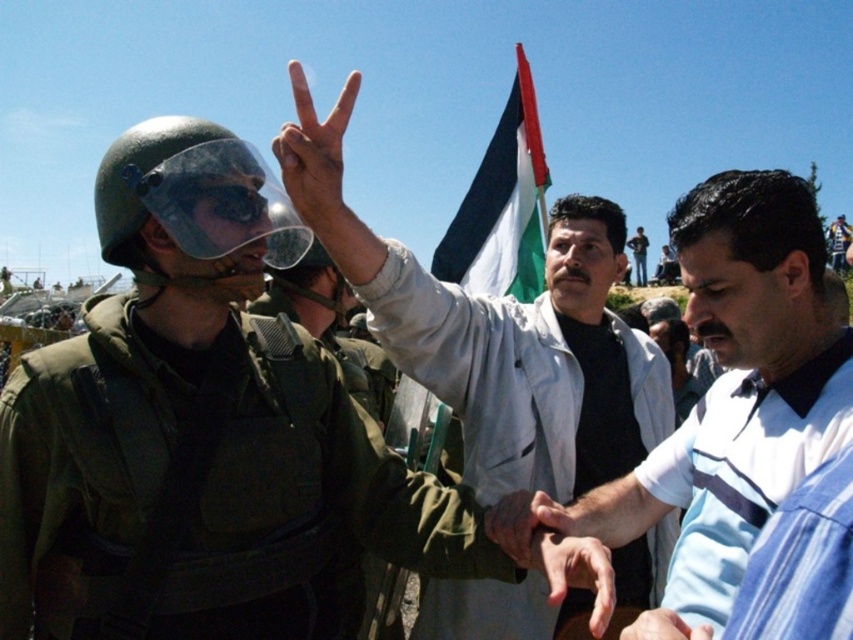
You are a photographer trying to capture a closeup of the smooth skin hand at center and the striped polo shirt at right. Which object should you focus on first to ensure it appears sharp in the photo?

The smooth skin hand at center should be focused on first since it is closer to the viewer than the striped polo shirt at right, ensuring it will appear sharp while the background object may be slightly blurred.

Based on the photo, you are a photographer trying to capture a closeup of the smooth skin hand at center and the striped polo shirt at right in the image. Based on their sizes, which object would require you to move closer to get a clear shot?

The smooth skin hand at center is shorter than the striped polo shirt at right, so you would need to move closer to the smooth skin hand at center to capture it clearly.